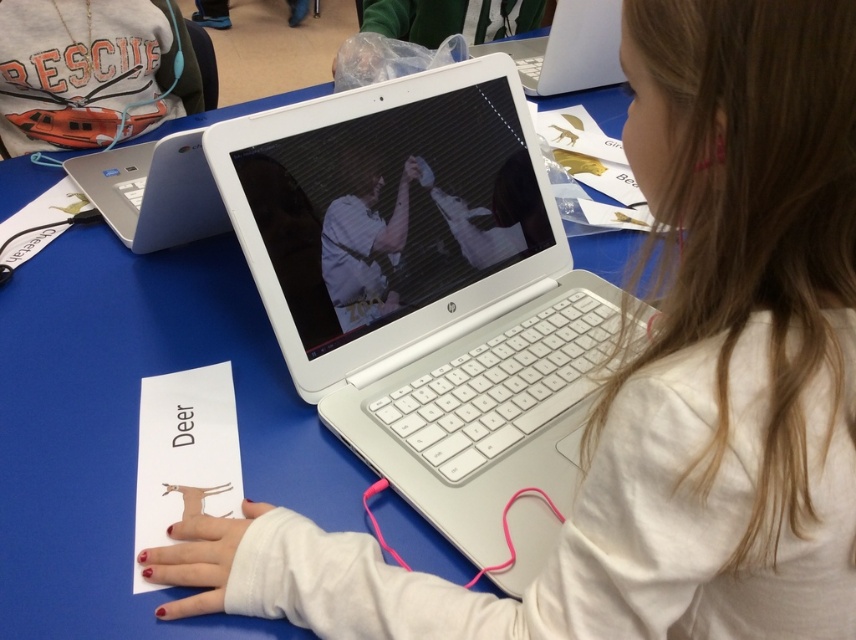
Question: Which point is farther from the camera taking this photo?

Choices:
 (A) (58, 16)
 (B) (550, 42)
 (C) (366, 321)

Answer: (B)

Question: Is white plastic laptop at center further to the viewer compared to matte orange lifeboat at upper left?

Choices:
 (A) yes
 (B) no

Answer: (B)

Question: Does matte orange lifeboat at upper left have a larger size compared to white plastic laptop at upper center?

Choices:
 (A) no
 (B) yes

Answer: (B)

Question: Considering the real-world distances, which object is farthest from the white plastic laptop at upper center?

Choices:
 (A) matte orange lifeboat at upper left
 (B) white plastic laptop at center

Answer: (A)

Question: Which point is farther to the camera?

Choices:
 (A) (545, 317)
 (B) (568, 38)

Answer: (B)

Question: Is white plastic laptop at center bigger than matte orange lifeboat at upper left?

Choices:
 (A) no
 (B) yes

Answer: (B)